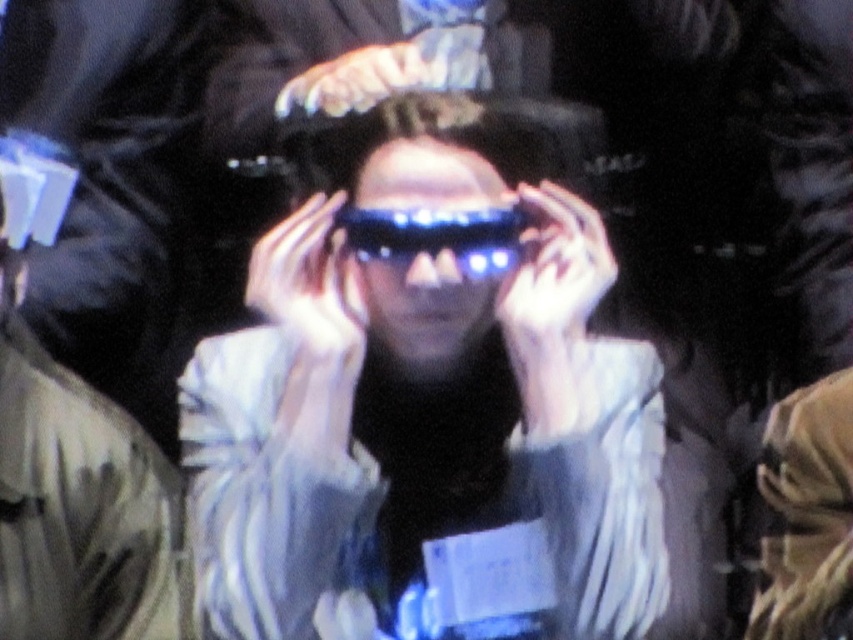
Is point (206, 468) farther from camera compared to point (519, 227)?

That is True.

Who is more forward, (579,616) or (434,211)?

Point (579,616) is more forward.

Where is `shiny metallic glasses at center`? The image size is (853, 640). shiny metallic glasses at center is located at coordinates (421, 417).